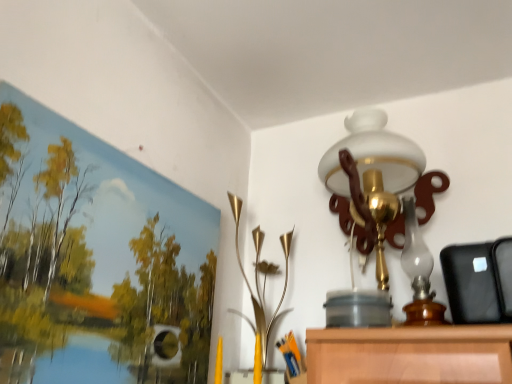
Question: Which is correct: matte canvas landscape at upper left is inside white glass lamp at upper center, the first lamp from the right, or outside of it?

Choices:
 (A) inside
 (B) outside

Answer: (B)

Question: Based on their sizes in the image, would you say matte canvas landscape at upper left is bigger or smaller than white glass lamp at upper center, positioned as the second lamp in left-to-right order?

Choices:
 (A) small
 (B) big

Answer: (A)

Question: Which object is the closest to the matte canvas landscape at upper left?

Choices:
 (A) gold metallic vase at center, which is the first lamp from left to right
 (B) white glass lamp at upper center, positioned as the second lamp in left-to-right order

Answer: (A)

Question: Estimate the real-world distances between objects in this image. Which object is closer to the matte canvas landscape at upper left?

Choices:
 (A) gold metallic vase at center, the second lamp viewed from the right
 (B) white glass lamp at upper center, positioned as the second lamp in left-to-right order

Answer: (A)